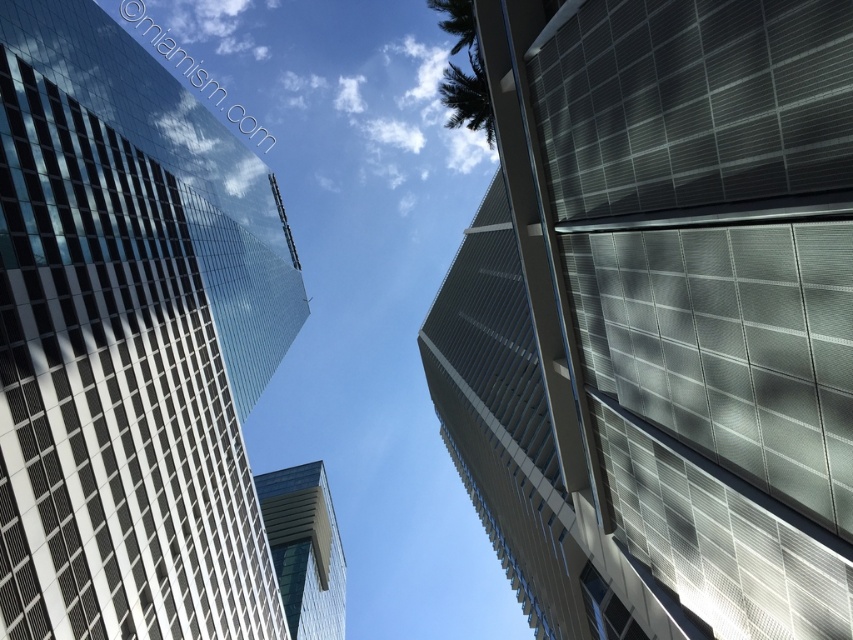
Question: Which is nearer to the sleek metallic building at upper right?

Choices:
 (A) transparent glass skyscraper at upper left
 (B) glassy blue skyscraper at center

Answer: (A)

Question: Which object is farther from the camera taking this photo?

Choices:
 (A) glassy blue skyscraper at center
 (B) transparent glass skyscraper at upper left

Answer: (A)

Question: Does sleek metallic building at upper right appear under glassy blue skyscraper at center?

Choices:
 (A) no
 (B) yes

Answer: (A)

Question: Which point is closer to the camera taking this photo?

Choices:
 (A) (299, 637)
 (B) (520, 42)

Answer: (B)

Question: Where is sleek metallic building at upper right located in relation to transparent glass skyscraper at upper left in the image?

Choices:
 (A) right
 (B) left

Answer: (A)

Question: Can you confirm if transparent glass skyscraper at upper left is bigger than glassy blue skyscraper at center?

Choices:
 (A) no
 (B) yes

Answer: (B)